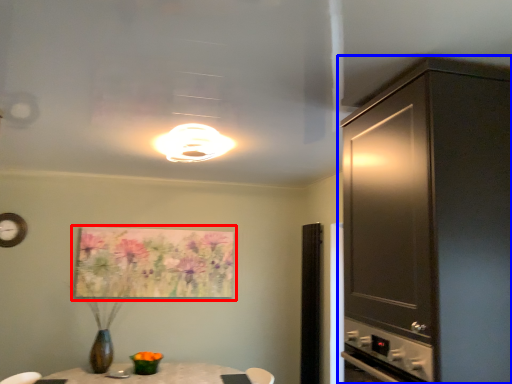
Question: Which point is further to the camera, picture frame (highlighted by a red box) or cabinetry (highlighted by a blue box)?

Choices:
 (A) picture frame
 (B) cabinetry

Answer: (A)